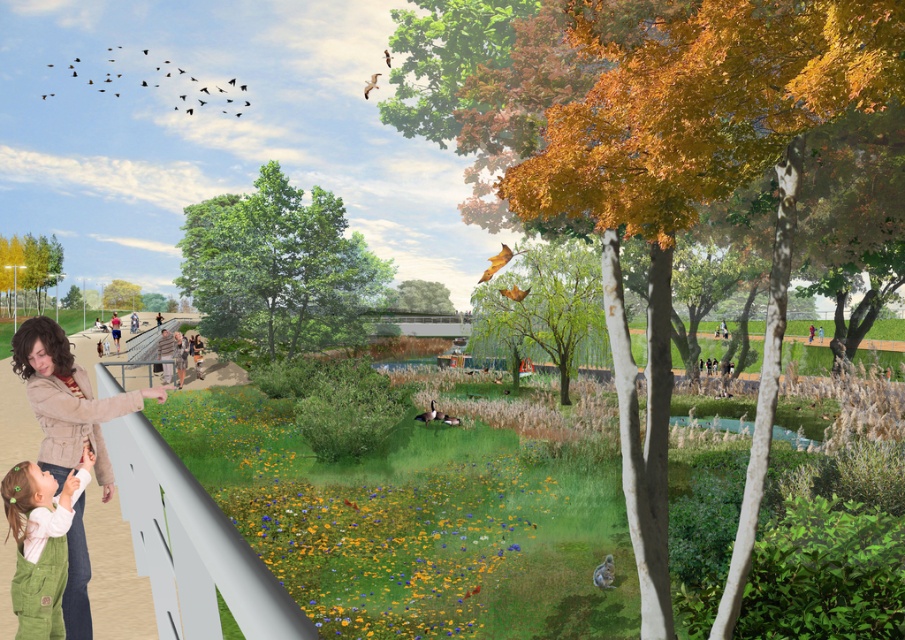
Can you confirm if matte beige jacket at lower left is positioned above green corduroy overalls at lower left?

Correct, matte beige jacket at lower left is located above green corduroy overalls at lower left.

What do you see at coordinates (65, 400) in the screenshot?
I see `matte beige jacket at lower left` at bounding box center [65, 400].

Where is `matte beige jacket at lower left`? This screenshot has height=640, width=905. matte beige jacket at lower left is located at coordinates (65, 400).

Identify the location of matte beige jacket at lower left. Image resolution: width=905 pixels, height=640 pixels. (65, 400).